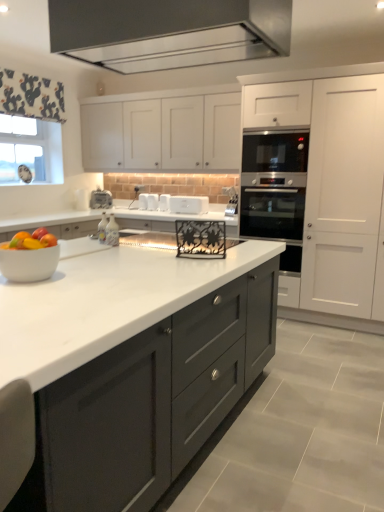
Question: Considering the relative positions of white glossy toaster at center, which is the 1th appliance from right to left, and satin silver oven at center-right in the image provided, is white glossy toaster at center, which is the 1th appliance from right to left, behind satin silver oven at center-right?

Choices:
 (A) no
 (B) yes

Answer: (B)

Question: From a real-world perspective, is white glossy toaster at center, which is the 1th appliance from right to left, located higher than satin silver oven at center-right?

Choices:
 (A) no
 (B) yes

Answer: (B)

Question: Is there a large distance between white glossy toaster at center, which is the 1th appliance from right to left, and satin silver oven at center-right?

Choices:
 (A) no
 (B) yes

Answer: (A)

Question: Could you tell me if white glossy toaster at center, which is the 1th appliance from right to left, is facing satin silver oven at center-right?

Choices:
 (A) no
 (B) yes

Answer: (A)

Question: Is white glossy toaster at center, which is the 1th appliance from right to left, at the right side of satin silver oven at center-right?

Choices:
 (A) no
 (B) yes

Answer: (A)

Question: Is point (210, 139) positioned closer to the camera than point (140, 208)?

Choices:
 (A) farther
 (B) closer

Answer: (B)

Question: Is white matte cabinet at upper center, the second cabinetry from the right, bigger or smaller than white plastic toaster at center, which appears as the second appliance when viewed from the left?

Choices:
 (A) small
 (B) big

Answer: (B)

Question: Relative to white plastic toaster at center, acting as the 4th appliance starting from the right, is white matte cabinet at upper center, the 1th cabinetry from the left, in front or behind?

Choices:
 (A) behind
 (B) front

Answer: (B)

Question: In terms of width, does white matte cabinet at upper center, the second cabinetry from the right, look wider or thinner when compared to white plastic toaster at center, which appears as the second appliance when viewed from the left?

Choices:
 (A) wide
 (B) thin

Answer: (A)

Question: In terms of size, does satin metallic exhaust hood at upper center appear bigger or smaller than white fabric at upper left?

Choices:
 (A) small
 (B) big

Answer: (B)

Question: Visually, is satin metallic exhaust hood at upper center positioned to the left or to the right of white fabric at upper left?

Choices:
 (A) left
 (B) right

Answer: (B)

Question: From a real-world perspective, is satin metallic exhaust hood at upper center positioned above or below white fabric at upper left?

Choices:
 (A) above
 (B) below

Answer: (A)

Question: Is satin metallic exhaust hood at upper center wider or thinner than white fabric at upper left?

Choices:
 (A) wide
 (B) thin

Answer: (A)

Question: Based on their sizes in the image, would you say satin silver oven at center-right is bigger or smaller than white fabric at upper left?

Choices:
 (A) small
 (B) big

Answer: (B)

Question: Is satin silver oven at center-right wider or thinner than white fabric at upper left?

Choices:
 (A) thin
 (B) wide

Answer: (B)